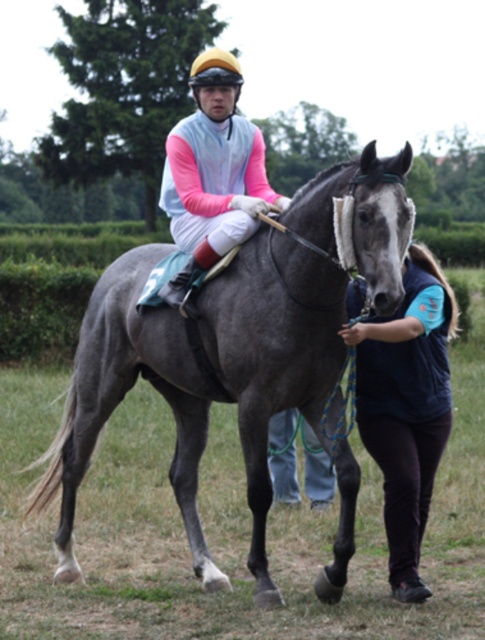
Does gray glossy horse at center come behind matte pink jersey at center?

That is False.

What do you see at coordinates (232, 348) in the screenshot? I see `gray glossy horse at center` at bounding box center [232, 348].

Image resolution: width=485 pixels, height=640 pixels. I want to click on gray glossy horse at center, so click(x=232, y=348).

Can you confirm if dark blue fleece vest at lower right is positioned below matte pink jersey at center?

Yes.

Can you confirm if dark blue fleece vest at lower right is positioned above matte pink jersey at center?

No.

Is point (411, 360) farther from viewer compared to point (179, 280)?

No.

I want to click on dark blue fleece vest at lower right, so pos(406,406).

Who is positioned more to the right, gray glossy horse at center or dark blue fleece vest at lower right?

Positioned to the right is dark blue fleece vest at lower right.

At what (x,y) coordinates should I click in order to perform the action: click on gray glossy horse at center. Please return your answer as a coordinate pair (x, y). Looking at the image, I should click on (232, 348).

Is point (158, 340) closer to camera compared to point (395, 573)?

That is False.

Where is `gray glossy horse at center`? This screenshot has height=640, width=485. gray glossy horse at center is located at coordinates (232, 348).